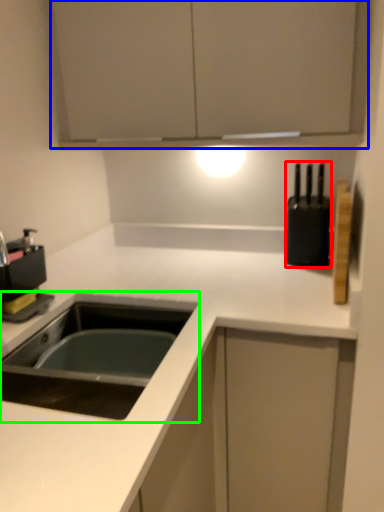
Question: Considering the real-world distances, which object is closest to appliance (highlighted by a red box)? cabinetry (highlighted by a blue box) or sink (highlighted by a green box).

Choices:
 (A) cabinetry
 (B) sink

Answer: (A)